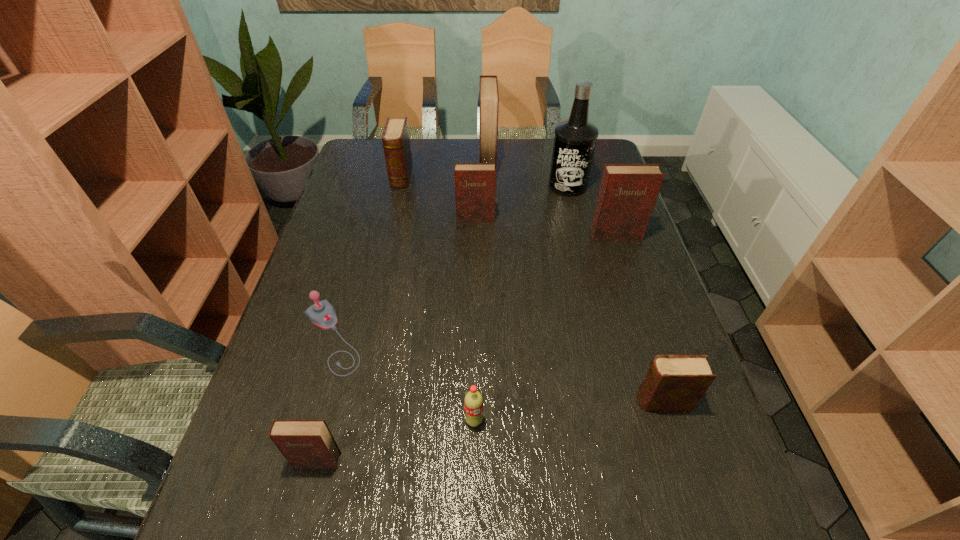
This screenshot has height=540, width=960. I want to click on vacant space located 0.290m on the front cover of the tallest diary, so click(397, 163).

The height and width of the screenshot is (540, 960). What are the coordinates of `vacant space positioned on the front cover of the tallest diary` in the screenshot? It's located at (392, 163).

This screenshot has width=960, height=540. Identify the location of vacant space located 0.070m on the front cover of the rightmost reddish-brown diary. (623, 258).

This screenshot has height=540, width=960. Find the location of `free location located 0.310m on the spine side of the bigger brown diary`. free location located 0.310m on the spine side of the bigger brown diary is located at coordinates (384, 254).

Find the location of a particular element. free location located on the front cover of the second farthest reddish-brown diary is located at coordinates (474, 267).

Where is `blank space located on the spine side of the nearer brown diary`? This screenshot has width=960, height=540. blank space located on the spine side of the nearer brown diary is located at coordinates 530,401.

Locate an element on the screen. free space located 0.320m on the spine side of the nearer brown diary is located at coordinates (482, 401).

The image size is (960, 540). Identify the location of vacant area located 0.390m on the spine side of the nearer brown diary. (448, 401).

The width and height of the screenshot is (960, 540). Identify the location of free point located 0.070m on the left of the soda. (430, 421).

The width and height of the screenshot is (960, 540). Identify the location of vacant point located 0.130m on the right of the joystick. (421, 338).